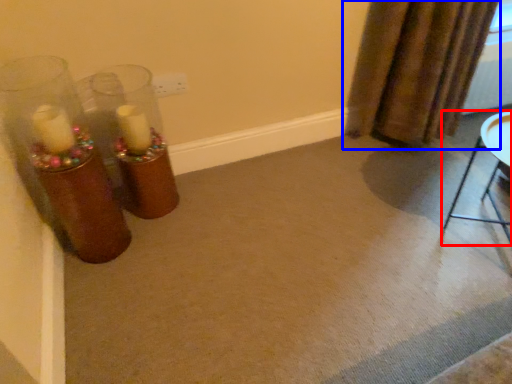
Question: Which object is further to the camera taking this photo, furniture (highlighted by a red box) or curtain (highlighted by a blue box)?

Choices:
 (A) furniture
 (B) curtain

Answer: (B)